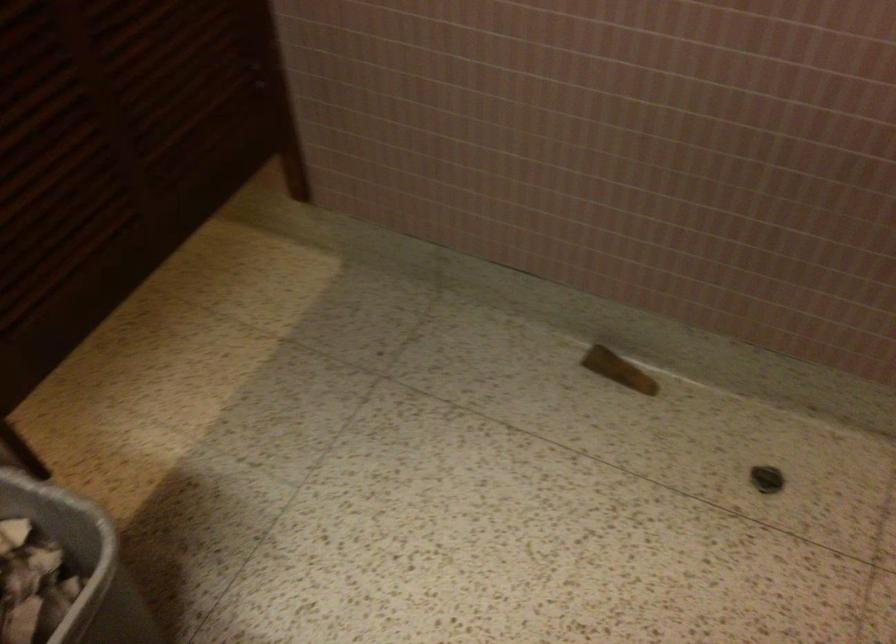
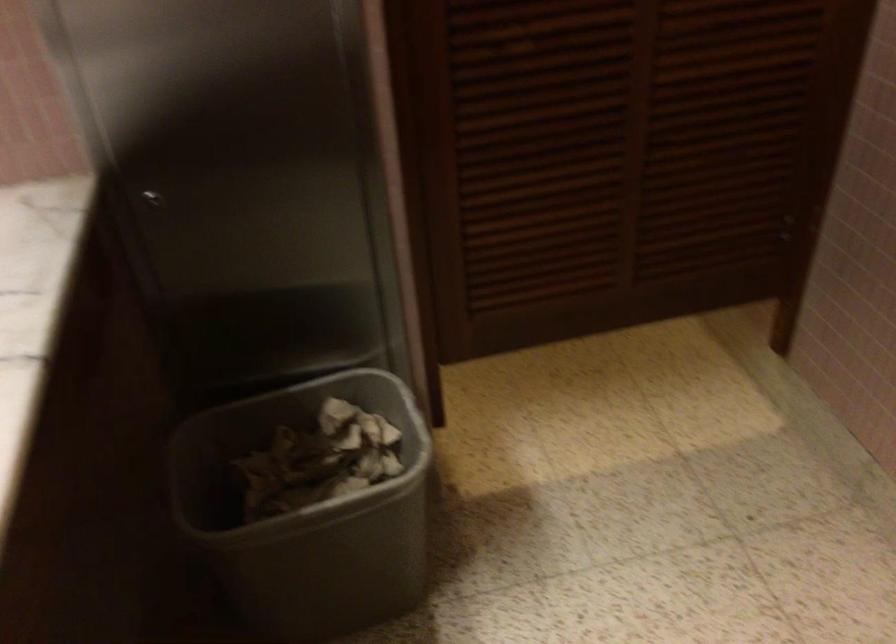
Question: The images are taken continuously from a first-person perspective. In which direction is your viewpoint rotating?

Choices:
 (A) Left
 (B) Right
 (C) Up
 (D) Down

Answer: (A)